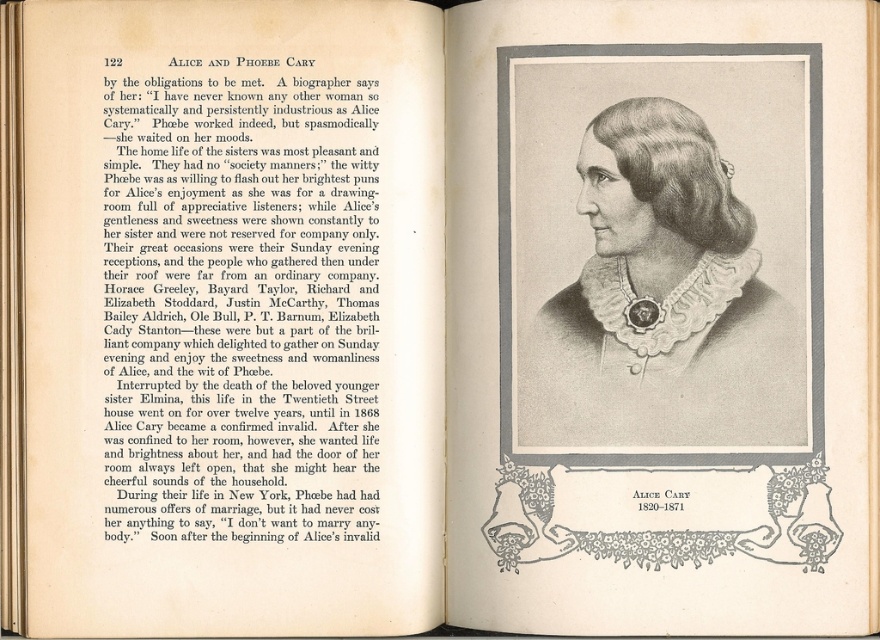
Question: Which object is closer to the camera taking this photo?

Choices:
 (A) black paper text at upper left
 (B) black and white portrait at center

Answer: (A)

Question: Among these objects, which one is farthest from the camera?

Choices:
 (A) black paper text at upper left
 (B) black and white portrait at center

Answer: (B)

Question: Does black paper text at upper left have a larger size compared to black and white portrait at center?

Choices:
 (A) no
 (B) yes

Answer: (B)

Question: Does black paper text at upper left have a lesser width compared to black and white portrait at center?

Choices:
 (A) yes
 (B) no

Answer: (A)

Question: Is black paper text at upper left to the left of black and white portrait at center from the viewer's perspective?

Choices:
 (A) yes
 (B) no

Answer: (A)